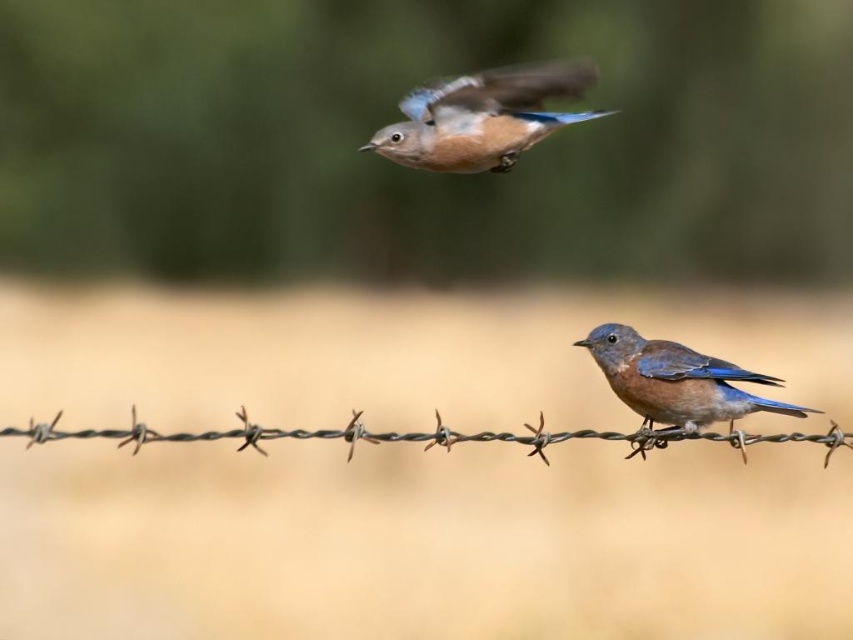
Who is higher up, blue glossy bird at upper center or blue glossy bird at center?

blue glossy bird at upper center is above.

Is point (440, 100) behind point (605, 349)?

No, it is in front of (605, 349).

The image size is (853, 640). I want to click on blue glossy bird at upper center, so click(x=483, y=116).

Locate an element on the screen. blue glossy bird at upper center is located at coordinates (483, 116).